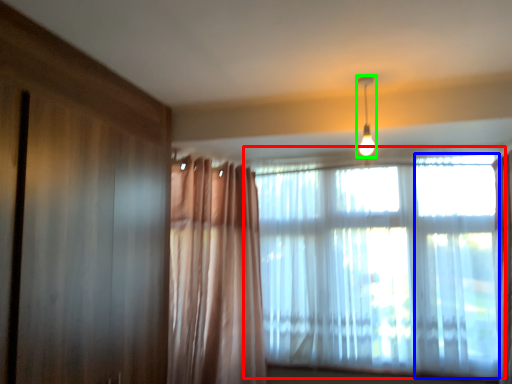
Question: Based on their relative distances, which object is farther from window (highlighted by a red box)? Choose from window (highlighted by a blue box) and light fixture (highlighted by a green box).

Choices:
 (A) window
 (B) light fixture

Answer: (B)